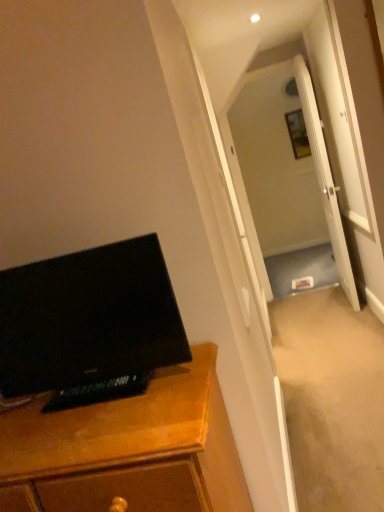
Identify the location of vacant space underneath black glossy monitor at left (from a real-world perspective). (123, 390).